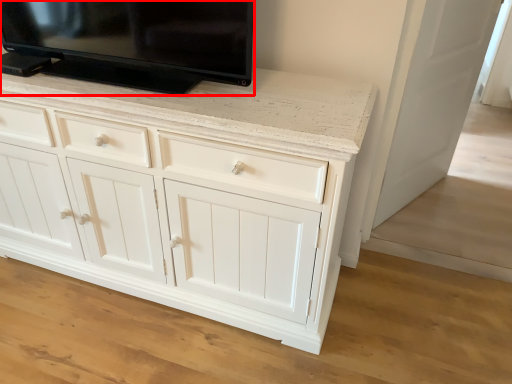
Question: From the image's perspective, what is the correct spatial positioning of television (annotated by the red box) in reference to door?

Choices:
 (A) below
 (B) above

Answer: (B)